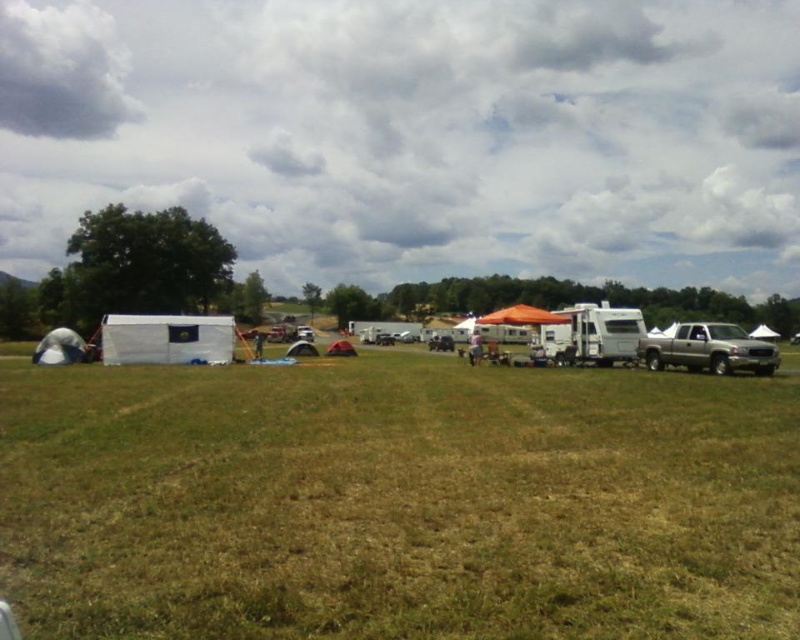
Question: Which is nearer to the silver metallic truck at right?

Choices:
 (A) green grassy field at lower center
 (B) white fabric tent at lower left
 (C) orange fabric tent at center

Answer: (A)

Question: Can you confirm if green grassy field at lower center is wider than orange fabric tent at center?

Choices:
 (A) yes
 (B) no

Answer: (A)

Question: Is the position of green grassy field at lower center more distant than that of white canvas tent at left?

Choices:
 (A) yes
 (B) no

Answer: (B)

Question: Which point is closer to the camera?

Choices:
 (A) white canvas tent at lower left
 (B) orange fabric tent at center
 (C) white canvas tent at left

Answer: (A)

Question: Which point is closer to the camera?

Choices:
 (A) (145, 342)
 (B) (646, 337)

Answer: (B)

Question: Where is orange fabric tent at center located in relation to red fabric tent at center in the image?

Choices:
 (A) right
 (B) left

Answer: (B)